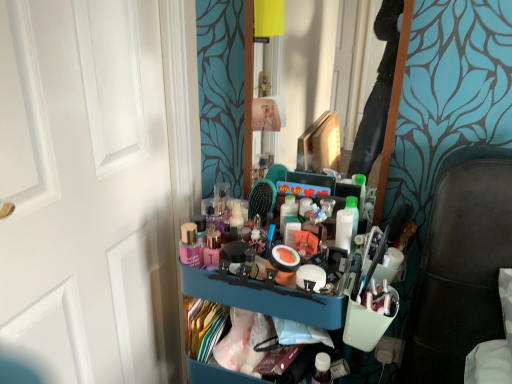
In order to click on free point above blue plastic bookshelf at center (from a real-world perspective) in this screenshot , I will do `click(268, 260)`.